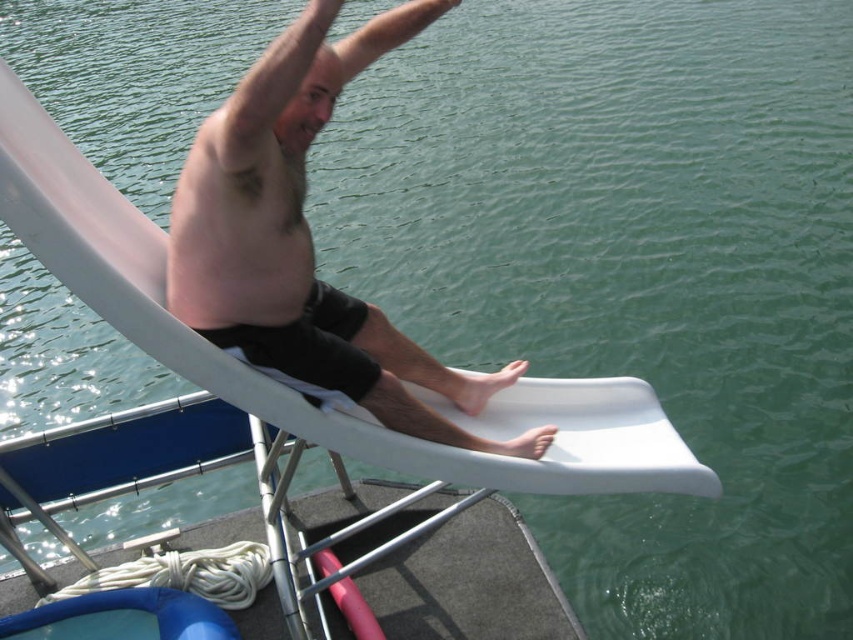
Consider the image. Based on the scene description, where is the smooth skin man at center positioned in relation to the water slide and the body of water below?

The smooth skin man at center is positioned at the top of the white plastic water slide, ready to slide down into the body of water below.

You are a photographer standing at the base of the water slide. You want to take a photo of the smooth skin man at center as he begins his slide. If your camera has a maximum focus range of 4 meters, will you be able to capture him clearly?

The smooth skin man at center is 3.86 meters away from the camera, which is within the 4 meter maximum focus range. Therefore, the photographer can capture him clearly.

You are a lifeguard observing the scene. There is a point marked at coordinates [305,236]. What object or feature does this point correspond to?

The point at coordinates [305,236] corresponds to the smooth skin man at center.